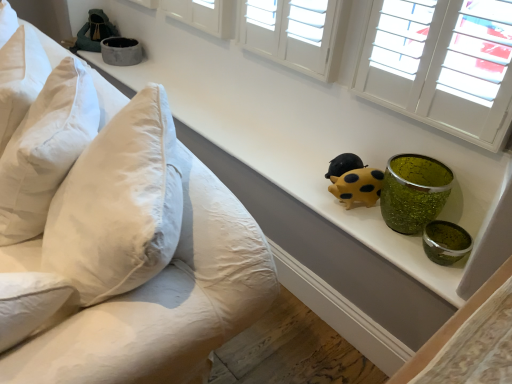
Question: From the image's perspective, is white cotton pillows at left on velvet green bag at upper left, placed as the 2th toy when sorted from front to back?

Choices:
 (A) yes
 (B) no

Answer: (B)

Question: From a real-world perspective, is white cotton pillows at left physically above velvet green bag at upper left, placed as the 2th toy when sorted from front to back?

Choices:
 (A) yes
 (B) no

Answer: (B)

Question: Considering the relative sizes of white cotton pillows at left and velvet green bag at upper left, which is the 1th toy in back-to-front order, in the image provided, is white cotton pillows at left taller than velvet green bag at upper left, which is the 1th toy in back-to-front order,?

Choices:
 (A) yes
 (B) no

Answer: (A)

Question: Is white cotton pillows at left bigger than velvet green bag at upper left, placed as the 2th toy when sorted from front to back?

Choices:
 (A) yes
 (B) no

Answer: (A)

Question: From the image's perspective, does white cotton pillows at left appear lower than velvet green bag at upper left, which is the 1th toy in back-to-front order?

Choices:
 (A) no
 (B) yes

Answer: (B)

Question: Is white cotton pillows at left further to the viewer compared to velvet green bag at upper left, positioned as the 2th toy in bottom-to-top order?

Choices:
 (A) yes
 (B) no

Answer: (B)

Question: Is there a large distance between yellow matte pig at center, positioned as the first toy in right-to-left order, and matte gray bowl at upper left?

Choices:
 (A) yes
 (B) no

Answer: (A)

Question: Is yellow matte pig at center, acting as the 1th toy starting from the bottom, oriented away from matte gray bowl at upper left?

Choices:
 (A) yes
 (B) no

Answer: (B)

Question: Considering the relative sizes of yellow matte pig at center, which is counted as the 2th toy, starting from the left, and matte gray bowl at upper left in the image provided, is yellow matte pig at center, which is counted as the 2th toy, starting from the left, shorter than matte gray bowl at upper left?

Choices:
 (A) yes
 (B) no

Answer: (B)

Question: Considering the relative sizes of yellow matte pig at center, positioned as the first toy in right-to-left order, and matte gray bowl at upper left in the image provided, is yellow matte pig at center, positioned as the first toy in right-to-left order, smaller than matte gray bowl at upper left?

Choices:
 (A) no
 (B) yes

Answer: (B)

Question: Considering the relative sizes of yellow matte pig at center, acting as the 1th toy starting from the bottom, and matte gray bowl at upper left in the image provided, is yellow matte pig at center, acting as the 1th toy starting from the bottom, wider than matte gray bowl at upper left?

Choices:
 (A) yes
 (B) no

Answer: (B)

Question: Considering the relative sizes of yellow matte pig at center, acting as the 1th toy starting from the bottom, and matte gray bowl at upper left in the image provided, is yellow matte pig at center, acting as the 1th toy starting from the bottom, bigger than matte gray bowl at upper left?

Choices:
 (A) yes
 (B) no

Answer: (B)

Question: Does matte gray bowl at upper left have a smaller size compared to white cotton pillow at left, marked as the first pillow in a bottom-to-top arrangement?

Choices:
 (A) yes
 (B) no

Answer: (A)